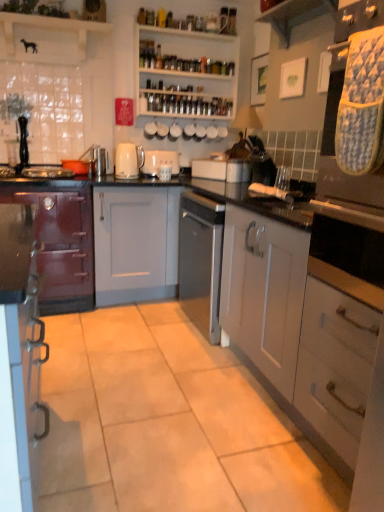
At what (x,y) coordinates should I click in order to perform the action: click on white glossy kettle at center. Please return your answer as a coordinate pair (x, y). The height and width of the screenshot is (512, 384). Looking at the image, I should click on (128, 160).

What do you see at coordinates (283, 178) in the screenshot?
I see `satin silver toaster at center, which is the first appliance from right to left` at bounding box center [283, 178].

Measure the distance between point (75, 53) and camera.

3.00 meters.

What is the approximate width of white matte cabinet at center, which ranks as the first cabinetry in right-to-left order?

The width of white matte cabinet at center, which ranks as the first cabinetry in right-to-left order, is 23.99 inches.

Locate an element on the screen. This screenshot has width=384, height=512. white glossy shelves at upper center, which is the 2th shelf from left to right is located at coordinates [187, 71].

The height and width of the screenshot is (512, 384). What do you see at coordinates (68, 230) in the screenshot? I see `matte gray cabinet at center, which ranks as the 2th cabinetry in right-to-left order` at bounding box center [68, 230].

Image resolution: width=384 pixels, height=512 pixels. What do you see at coordinates (160, 162) in the screenshot?
I see `white matte toaster at center, which is the first appliance from top to bottom` at bounding box center [160, 162].

This screenshot has height=512, width=384. What are the coordinates of `white glossy kettle at center` in the screenshot? It's located at (128, 160).

From the picture: Considering the sizes of matte gray cabinet at center, which ranks as the 2th cabinetry in right-to-left order, and white matte cabinet at center, which ranks as the first cabinetry in right-to-left order, in the image, is matte gray cabinet at center, which ranks as the 2th cabinetry in right-to-left order, taller or shorter than white matte cabinet at center, which ranks as the first cabinetry in right-to-left order,?

Considering their sizes, matte gray cabinet at center, which ranks as the 2th cabinetry in right-to-left order, has less height than white matte cabinet at center, which ranks as the first cabinetry in right-to-left order.

How different are the orientations of matte gray cabinet at center, which ranks as the 2th cabinetry in right-to-left order, and white matte cabinet at center, marked as the 3th cabinetry in a left-to-right arrangement, in degrees?

The facing directions of matte gray cabinet at center, which ranks as the 2th cabinetry in right-to-left order, and white matte cabinet at center, marked as the 3th cabinetry in a left-to-right arrangement, are 90.2 degrees apart.

Find the location of a particular element. the 2nd cabinetry above the white matte cabinet at center, which ranks as the first cabinetry in right-to-left order (from the image's perspective) is located at coordinates (68, 230).

Considering the sizes of matte gray cabinet at center, which ranks as the 2th cabinetry in right-to-left order, and white matte cabinet at center, which ranks as the first cabinetry in right-to-left order, in the image, is matte gray cabinet at center, which ranks as the 2th cabinetry in right-to-left order, bigger or smaller than white matte cabinet at center, which ranks as the first cabinetry in right-to-left order,?

Clearly, matte gray cabinet at center, which ranks as the 2th cabinetry in right-to-left order, is larger in size than white matte cabinet at center, which ranks as the first cabinetry in right-to-left order.

Is white glossy kettle at center placed right next to white matte toaster at center, placed as the 1th appliance when sorted from back to front?

white glossy kettle at center is not next to white matte toaster at center, placed as the 1th appliance when sorted from back to front, and they're not touching.

Is white glossy kettle at center situated inside white matte toaster at center, which appears as the 2th appliance when ordered from the bottom, or outside?

The correct answer is: outside.

Which is more to the left, white glossy kettle at center or white matte toaster at center, acting as the 2th appliance starting from the front?

From the viewer's perspective, white glossy kettle at center appears more on the left side.

The image size is (384, 512). I want to click on cabinetry that is the 2nd object to the right of the wooden shelf at upper center, positioned as the 2th shelf in back-to-front order, starting at the anchor, so click(x=307, y=319).

Is white matte cabinet at center, marked as the 3th cabinetry in a left-to-right arrangement, surrounding wooden shelf at upper center, positioned as the 2th shelf in back-to-front order?

No, wooden shelf at upper center, positioned as the 2th shelf in back-to-front order, is not inside white matte cabinet at center, marked as the 3th cabinetry in a left-to-right arrangement.

How distant is white matte cabinet at center, marked as the 3th cabinetry in a left-to-right arrangement, from wooden shelf at upper center, arranged as the first shelf when viewed from the left?

2.24 meters.

Looking at the image, does white matte cabinet at center, marked as the 3th cabinetry in a left-to-right arrangement, seem bigger or smaller compared to wooden shelf at upper center, arranged as the first shelf when viewed from the left?

Clearly, white matte cabinet at center, marked as the 3th cabinetry in a left-to-right arrangement, is larger in size than wooden shelf at upper center, arranged as the first shelf when viewed from the left.

Is satin silver toaster at center, placed as the second appliance when sorted from top to bottom, thinner than wooden shelf at upper center, acting as the second shelf starting from the right?

Correct, the width of satin silver toaster at center, placed as the second appliance when sorted from top to bottom, is less than that of wooden shelf at upper center, acting as the second shelf starting from the right.

Does satin silver toaster at center, marked as the first appliance in a front-to-back arrangement, have a larger size compared to wooden shelf at upper center, positioned as the 2th shelf in back-to-front order?

Incorrect, satin silver toaster at center, marked as the first appliance in a front-to-back arrangement, is not larger than wooden shelf at upper center, positioned as the 2th shelf in back-to-front order.

Where is `the 2nd shelf directly above the satin silver toaster at center, the second appliance when ordered from back to front (from a real-world perspective)`? the 2nd shelf directly above the satin silver toaster at center, the second appliance when ordered from back to front (from a real-world perspective) is located at coordinates (47, 38).

Does point (155, 184) come farther from viewer compared to point (107, 26)?

No, (155, 184) is in front of (107, 26).

Is matte gray cabinet at center, which ranks as the 2th cabinetry in right-to-left order, inside or outside of wooden shelf at upper center, acting as the second shelf starting from the right?

matte gray cabinet at center, which ranks as the 2th cabinetry in right-to-left order, cannot be found inside wooden shelf at upper center, acting as the second shelf starting from the right.

In terms of width, does matte gray cabinet at center, acting as the second cabinetry starting from the left, look wider or thinner when compared to wooden shelf at upper center, arranged as the first shelf when viewed from the left?

Clearly, matte gray cabinet at center, acting as the second cabinetry starting from the left, has more width compared to wooden shelf at upper center, arranged as the first shelf when viewed from the left.

Considering the relative sizes of matte gray cabinet at center, acting as the second cabinetry starting from the left, and wooden shelf at upper center, acting as the second shelf starting from the right, in the image provided, is matte gray cabinet at center, acting as the second cabinetry starting from the left, bigger than wooden shelf at upper center, acting as the second shelf starting from the right,?

Indeed, matte gray cabinet at center, acting as the second cabinetry starting from the left, has a larger size compared to wooden shelf at upper center, acting as the second shelf starting from the right.

From a real-world perspective, count 1st shelfs upward from the matte gray cabinet at center, acting as the second cabinetry starting from the left, and point to it. Please provide its 2D coordinates.

[(187, 71)]

Can matte gray cabinet at center, which ranks as the 2th cabinetry in right-to-left order, be found inside white glossy shelves at upper center, which is the 2th shelf from left to right?

No, white glossy shelves at upper center, which is the 2th shelf from left to right, does not contain matte gray cabinet at center, which ranks as the 2th cabinetry in right-to-left order.

Which object is thinner, white glossy shelves at upper center, the second shelf when ordered from front to back, or matte gray cabinet at center, acting as the second cabinetry starting from the left?

With smaller width is white glossy shelves at upper center, the second shelf when ordered from front to back.

Visually, is wooden shelf at upper center, arranged as the first shelf when viewed from the left, positioned to the left or to the right of matte burgundy cabinet at left, the third cabinetry positioned from the right?

wooden shelf at upper center, arranged as the first shelf when viewed from the left, is to the right of matte burgundy cabinet at left, the third cabinetry positioned from the right.

Is wooden shelf at upper center, positioned as the 2th shelf in back-to-front order, thinner than matte burgundy cabinet at left, the third cabinetry positioned from the right?

Correct, the width of wooden shelf at upper center, positioned as the 2th shelf in back-to-front order, is less than that of matte burgundy cabinet at left, the third cabinetry positioned from the right.

Is wooden shelf at upper center, arranged as the first shelf when viewed from the left, turned away from matte burgundy cabinet at left, the third cabinetry positioned from the right?

That's not correct — wooden shelf at upper center, arranged as the first shelf when viewed from the left, is not looking away from matte burgundy cabinet at left, the third cabinetry positioned from the right.

Is there a large distance between wooden shelf at upper center, which appears as the first shelf when viewed from the front, and matte burgundy cabinet at left, the third cabinetry positioned from the right?

Absolutely, wooden shelf at upper center, which appears as the first shelf when viewed from the front, is distant from matte burgundy cabinet at left, the third cabinetry positioned from the right.

Which cabinetry is the 2nd one when counting from the back of the white matte cabinet at center, marked as the 3th cabinetry in a left-to-right arrangement? Please provide its 2D coordinates.

[(68, 230)]

In order to click on kitchen appliance in front of the white matte toaster at center, which appears as the 2th appliance when ordered from the bottom in this screenshot , I will do 128,160.

Which object lies nearer to the anchor point matte gray cabinet at center, which ranks as the 2th cabinetry in right-to-left order, matte burgundy cabinet at left, the third cabinetry positioned from the right, or white glossy kettle at center?

Among the two, matte burgundy cabinet at left, the third cabinetry positioned from the right, is located nearer to matte gray cabinet at center, which ranks as the 2th cabinetry in right-to-left order.

Looking at the image, which one is located further to matte burgundy cabinet at left, which ranks as the 1th cabinetry in left-to-right order, white matte toaster at center, placed as the 1th appliance when sorted from back to front, or white matte cabinet at center, which ranks as the first cabinetry in right-to-left order?

white matte cabinet at center, which ranks as the first cabinetry in right-to-left order.

Considering their positions, is white glossy shelves at upper center, which is the 1th shelf from back to front, positioned further to satin silver toaster at center, the second appliance when ordered from back to front, than white matte cabinet at center, marked as the 3th cabinetry in a left-to-right arrangement?

Among the two, white glossy shelves at upper center, which is the 1th shelf from back to front, is located further to satin silver toaster at center, the second appliance when ordered from back to front.

Which object lies nearer to the anchor point satin silver toaster at center, which is the 1th appliance from bottom to top, white matte toaster at center, which is the first appliance from top to bottom, or white matte cabinet at center, which ranks as the first cabinetry in right-to-left order?

white matte toaster at center, which is the first appliance from top to bottom, lies closer to satin silver toaster at center, which is the 1th appliance from bottom to top, than the other object.

Which object lies further to the anchor point white matte cabinet at center, marked as the 3th cabinetry in a left-to-right arrangement, white glossy shelves at upper center, which is the 2th shelf from left to right, or matte gray cabinet at center, which ranks as the 2th cabinetry in right-to-left order?

The object further to white matte cabinet at center, marked as the 3th cabinetry in a left-to-right arrangement, is white glossy shelves at upper center, which is the 2th shelf from left to right.

Which object lies nearer to the anchor point matte burgundy cabinet at left, the third cabinetry positioned from the right, white matte cabinet at center, marked as the 3th cabinetry in a left-to-right arrangement, or white glossy shelves at upper center, the second shelf when ordered from front to back?

white glossy shelves at upper center, the second shelf when ordered from front to back.

In the scene shown: Which object lies nearer to the anchor point white matte cabinet at center, which ranks as the first cabinetry in right-to-left order, matte burgundy cabinet at left, the third cabinetry positioned from the right, or white glossy kettle at center?

Based on the image, matte burgundy cabinet at left, the third cabinetry positioned from the right, appears to be nearer to white matte cabinet at center, which ranks as the first cabinetry in right-to-left order.

From the image, which object appears to be nearer to wooden shelf at upper center, which appears as the first shelf when viewed from the front, white glossy kettle at center or satin silver toaster at center, placed as the second appliance when sorted from top to bottom?

The object closer to wooden shelf at upper center, which appears as the first shelf when viewed from the front, is white glossy kettle at center.

Find the location of a particular element. cabinetry situated between white matte toaster at center, which appears as the 2th appliance when ordered from the bottom, and satin silver toaster at center, marked as the first appliance in a front-to-back arrangement, from left to right is located at coordinates (68, 230).

The width and height of the screenshot is (384, 512). In order to click on shelf situated between white glossy kettle at center and satin silver toaster at center, marked as the first appliance in a front-to-back arrangement, from left to right in this screenshot , I will do `click(187, 71)`.

At what (x,y) coordinates should I click in order to perform the action: click on kitchen appliance between matte burgundy cabinet at left, the third cabinetry positioned from the right, and white matte cabinet at center, which ranks as the first cabinetry in right-to-left order, from left to right. Please return your answer as a coordinate pair (x, y). This screenshot has height=512, width=384. Looking at the image, I should click on (128, 160).

Image resolution: width=384 pixels, height=512 pixels. Find the location of `kitchen appliance positioned between white matte cabinet at center, marked as the 3th cabinetry in a left-to-right arrangement, and white matte toaster at center, positioned as the second appliance in right-to-left order, from near to far`. kitchen appliance positioned between white matte cabinet at center, marked as the 3th cabinetry in a left-to-right arrangement, and white matte toaster at center, positioned as the second appliance in right-to-left order, from near to far is located at coordinates (128, 160).